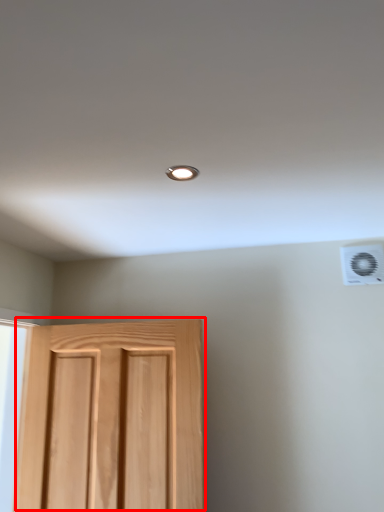
Question: From the image's perspective, where is door (annotated by the red box) located relative to air conditioning?

Choices:
 (A) below
 (B) above

Answer: (A)